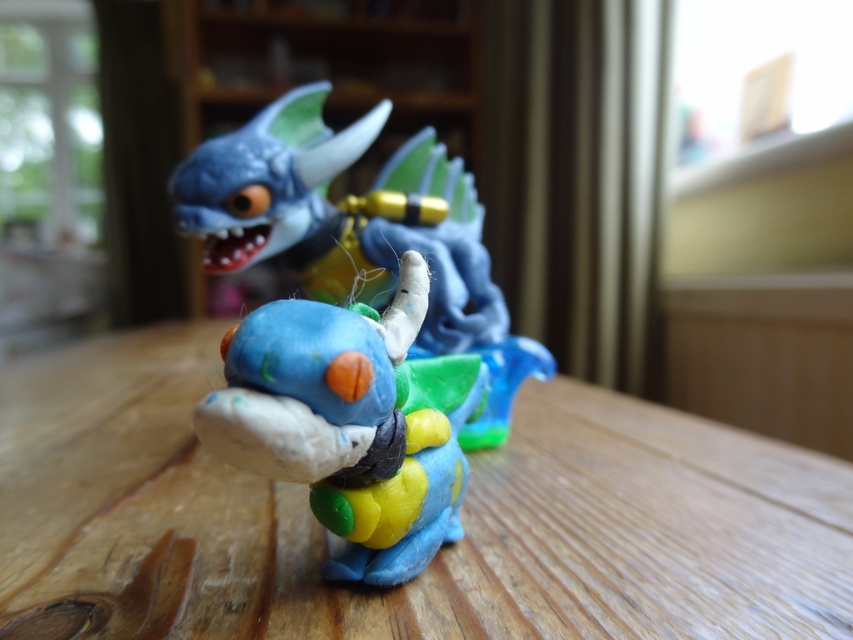
Does matte plastic dragon at center appear over matte plastic toy at center?

No.

Is matte plastic dragon at center to the right of matte plastic toy at center from the viewer's perspective?

Indeed, matte plastic dragon at center is positioned on the right side of matte plastic toy at center.

Does point (215, 435) lie in front of point (314, 237)?

That is True.

The width and height of the screenshot is (853, 640). I want to click on matte plastic dragon at center, so click(351, 420).

In the scene shown: Is wooden table at center closer to camera compared to matte plastic toy at center?

Yes, it is.

Is wooden table at center further to camera compared to matte plastic toy at center?

No, wooden table at center is closer to the viewer.

Locate an element on the screen. The image size is (853, 640). wooden table at center is located at coordinates (436, 554).

This screenshot has width=853, height=640. Identify the location of wooden table at center. (436, 554).

Does wooden table at center appear on the left side of matte plastic dragon at center?

Indeed, wooden table at center is positioned on the left side of matte plastic dragon at center.

Can you confirm if wooden table at center is taller than matte plastic dragon at center?

No.

What are the coordinates of `wooden table at center` in the screenshot? It's located at (436, 554).